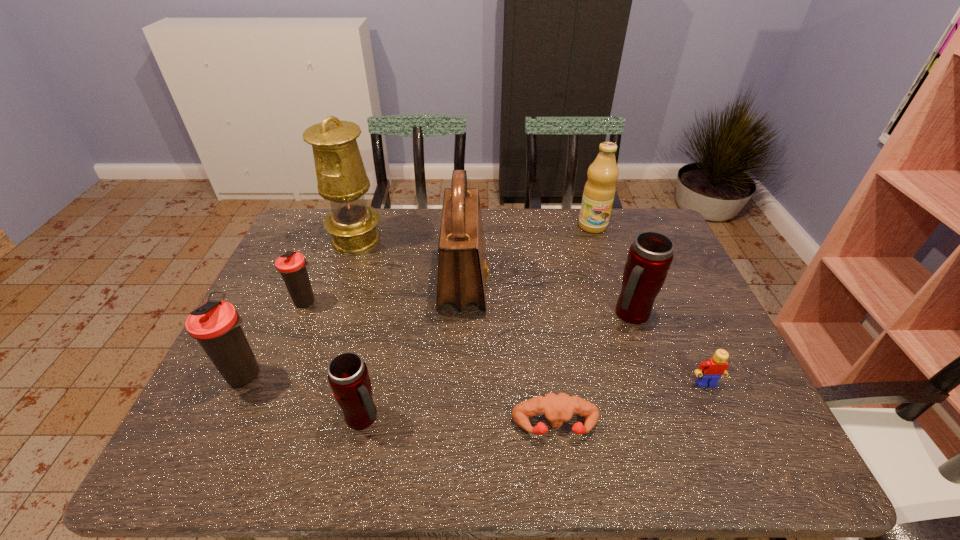
Find the location of a particular element. The width and height of the screenshot is (960, 540). free space that satisfies the following two spatial constraints: 1. on the side with the handle of the farther red thermos bottle; 2. on the side with the handle of the smaller red thermos bottle is located at coordinates (667, 417).